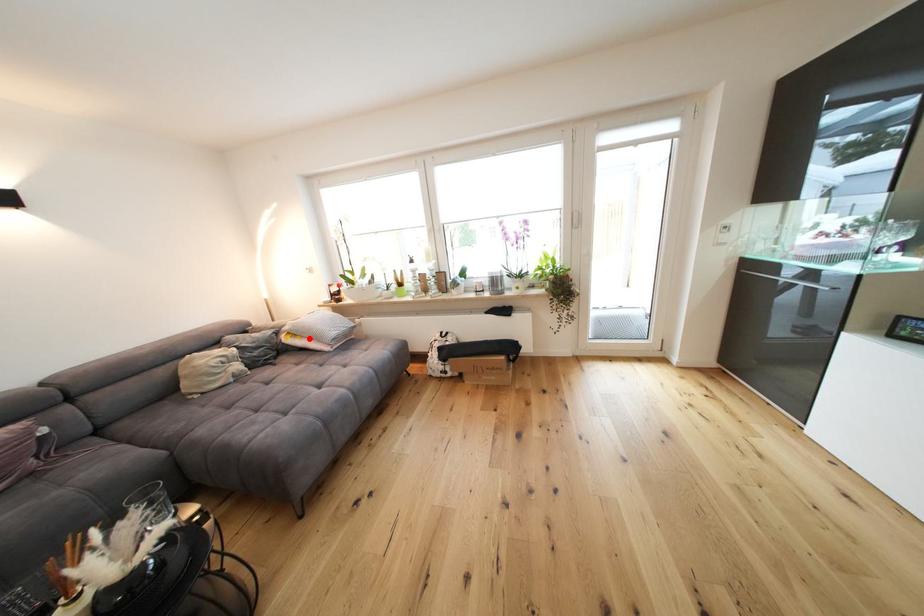
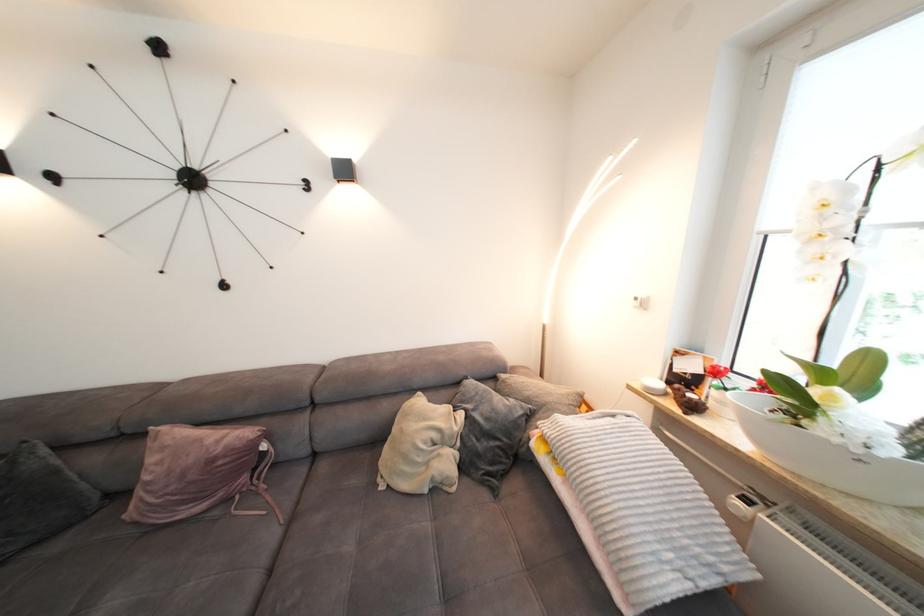
Where in the second image is the point corresponding to the highlighted location from the first image?

(574, 480)